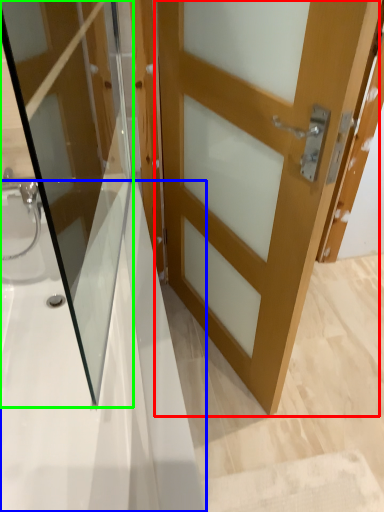
Question: Estimate the real-world distances between objects in this image. Which object is farther from door (highlighted by a red box), bath (highlighted by a blue box) or door (highlighted by a green box)?

Choices:
 (A) bath
 (B) door

Answer: (A)